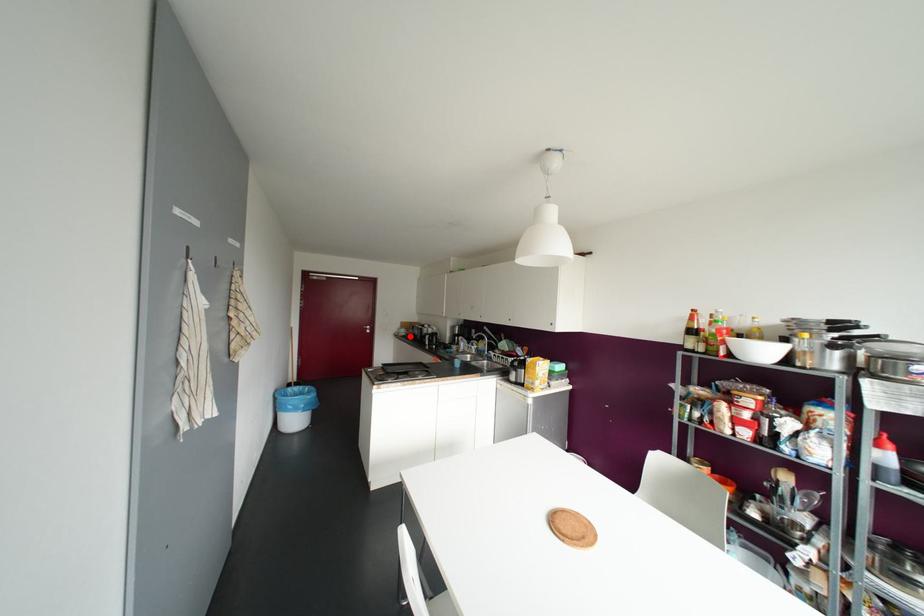
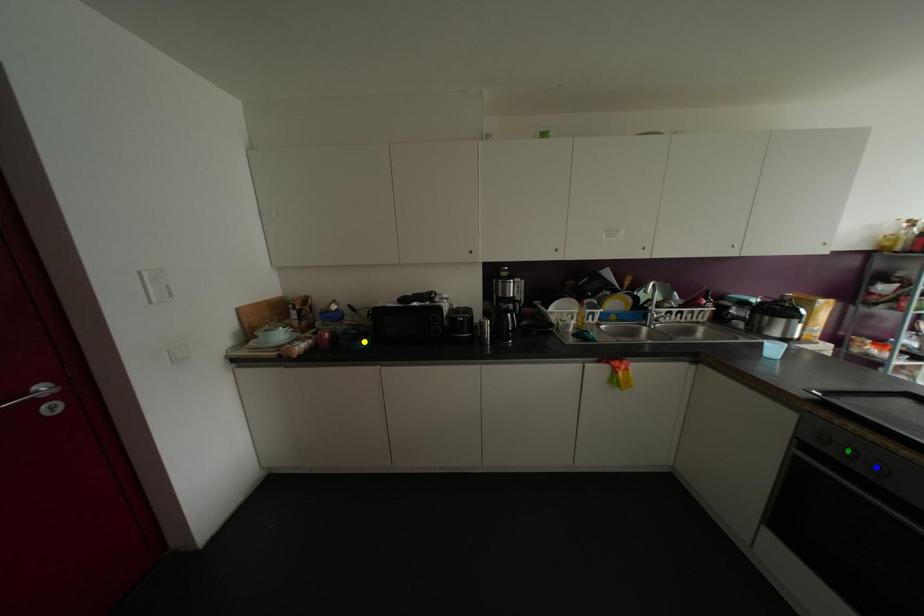
Question: I am providing you with two images of the same scene from different viewpoints. A red point is marked on the first image. You are given multiple points on the second image. Which point in image 2 represents the same 3d spot as the red point in image 1?

Choices:
 (A) blue point
 (B) green point
 (C) yellow point

Answer: (C)